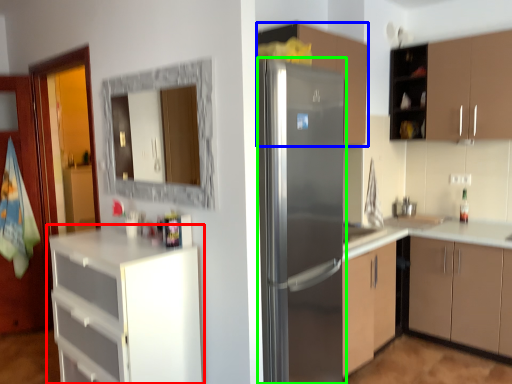
Question: Which object is positioned farthest from cabinetry (highlighted by a red box)? Select from cabinetry (highlighted by a blue box) and refrigerator (highlighted by a green box).

Choices:
 (A) cabinetry
 (B) refrigerator

Answer: (A)